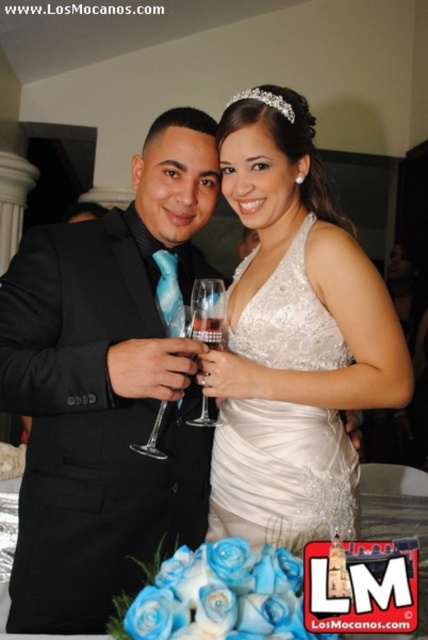
Question: Based on their relative distances, which object is nearer to the black satin suit at left?

Choices:
 (A) white satin dress at center
 (B) clear glass wine glass at center
 (C) clear crystal wine glass at center
 (D) clear glass wine at center

Answer: (B)

Question: In this image, where is black satin suit at left located relative to clear glass wine at center?

Choices:
 (A) below
 (B) above

Answer: (A)

Question: Which of the following is the farthest from the observer?

Choices:
 (A) (222, 332)
 (B) (20, 618)
 (C) (198, 328)
 (D) (177, 308)

Answer: (D)

Question: Does clear crystal wine glass at center have a lesser width compared to clear glass wine at center?

Choices:
 (A) no
 (B) yes

Answer: (A)

Question: Estimate the real-world distances between objects in this image. Which object is farther from the black satin suit at left?

Choices:
 (A) clear crystal wine glass at center
 (B) clear glass wine glass at center
 (C) clear glass wine at center
 (D) white satin dress at center

Answer: (C)

Question: Considering the relative positions of black satin suit at left and white satin dress at center in the image provided, where is black satin suit at left located with respect to white satin dress at center?

Choices:
 (A) right
 (B) left

Answer: (B)